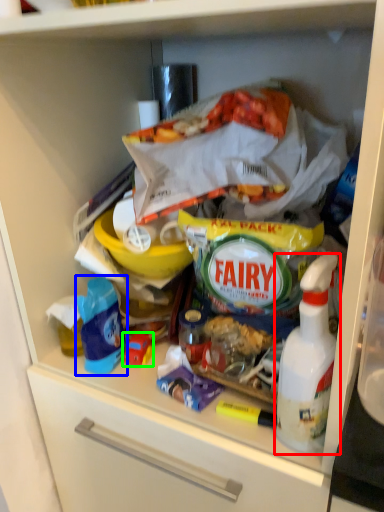
Question: Based on their relative distances, which object is nearer to bottle (highlighted by a red box)? Choose from product (highlighted by a blue box) and toy (highlighted by a green box).

Choices:
 (A) product
 (B) toy

Answer: (B)